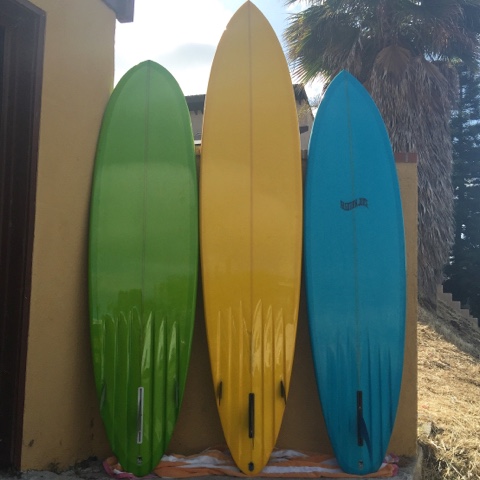
This screenshot has width=480, height=480. In order to click on towel in this screenshot , I will do `click(196, 461)`.